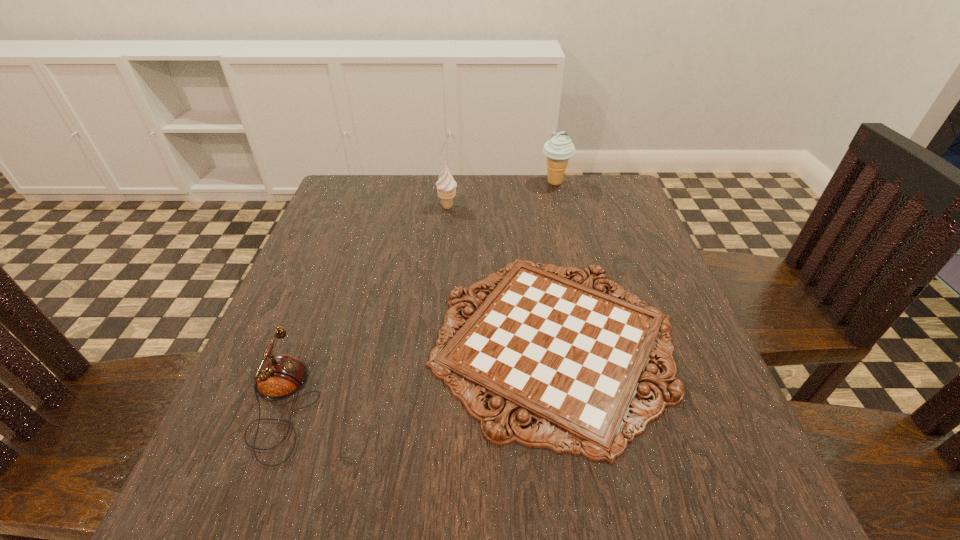
The height and width of the screenshot is (540, 960). I want to click on empty space that is in between the taller icecream and the leftmost object, so click(x=419, y=294).

Identify the location of free space that is in between the taller icecream and the chessboard. The height and width of the screenshot is (540, 960). (555, 262).

Identify the location of free space that is in between the nearer icecream and the right icecream. (501, 195).

This screenshot has width=960, height=540. Identify the location of vacant area between the telephone and the shortest object. (418, 373).

Identify which object is the second closest to the leftmost object. Please provide its 2D coordinates. Your answer should be formatted as a tuple, i.e. [(x, y)], where the tuple contains the x and y coordinates of a point satisfying the conditions above.

[(446, 186)]

Where is `object that stands as the closest to the shorter icecream`? object that stands as the closest to the shorter icecream is located at coordinates (561, 352).

The height and width of the screenshot is (540, 960). Find the location of `free space that satisfies the following two spatial constraints: 1. on the front-facing side of the shorter icecream; 2. on the back side of the chessboard`. free space that satisfies the following two spatial constraints: 1. on the front-facing side of the shorter icecream; 2. on the back side of the chessboard is located at coordinates (434, 341).

Image resolution: width=960 pixels, height=540 pixels. I want to click on vacant space that satisfies the following two spatial constraints: 1. on the front-facing side of the nearer icecream; 2. on the back side of the shortest object, so click(434, 341).

You are a GUI agent. You are given a task and a screenshot of the screen. Output one action in this format:
    pyautogui.click(x=<x>, y=<y>)
    Task: Click on the vacant region that satisfies the following two spatial constraints: 1. on the front-facing side of the shorter icecream; 2. on the right side of the chessboard
    This screenshot has height=540, width=960.
    Given the screenshot: What is the action you would take?
    point(434,341)

Identify the location of free space in the image that satisfies the following two spatial constraints: 1. on the front-facing side of the second farthest object; 2. on the left side of the shortest object. This screenshot has width=960, height=540. 434,341.